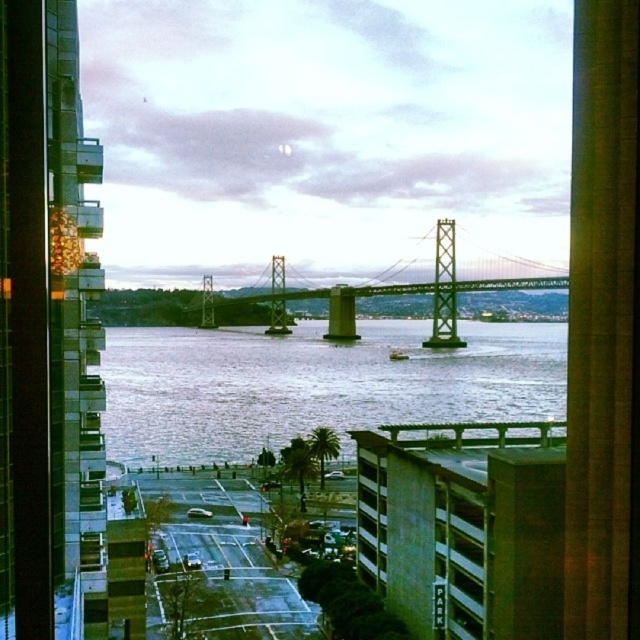
You are a city planner reviewing the cityscape image. You need to determine which object occupies more horizontal space in the scene. Which one is wider between the green matte parking garage at lower right and the green glass window at center?

The green matte parking garage at lower right is wider than the green glass window at center according to the description.